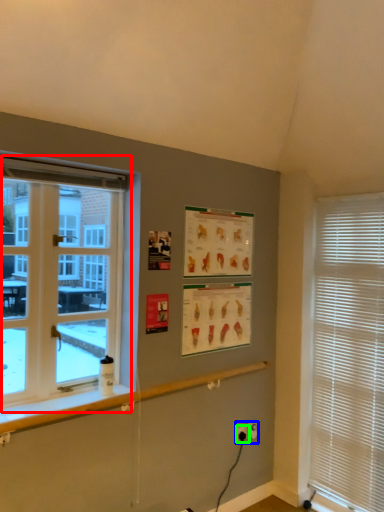
Question: Considering the real-world distances, which object is farthest from window (highlighted by a red box)? electric outlet (highlighted by a blue box) or electric outlet (highlighted by a green box)?

Choices:
 (A) electric outlet
 (B) electric outlet

Answer: (B)